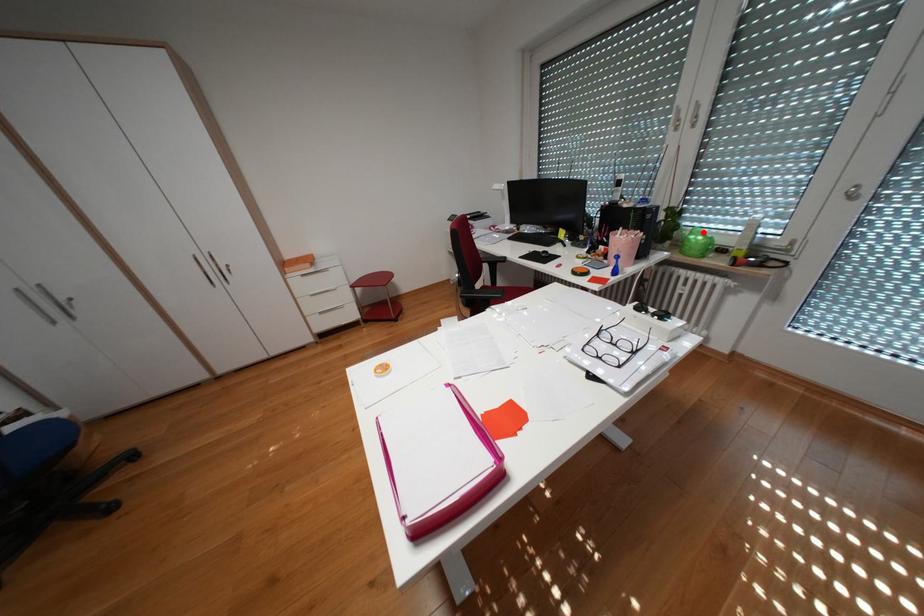
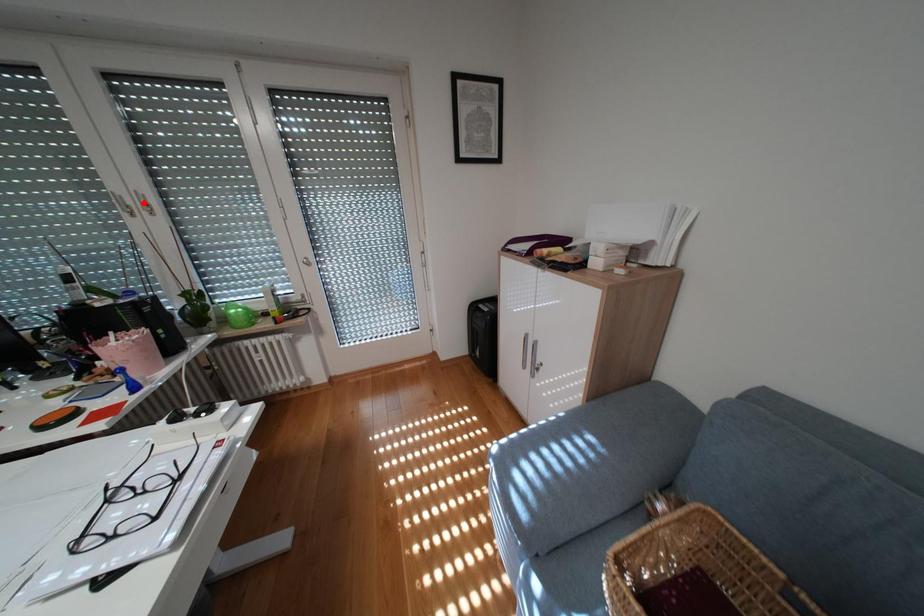
I am providing you with two images of the same scene from different viewpoints. A red point is marked on the first image and another point is marked on the second image. Is the red point in image1 aligned with the point shown in image2?

No